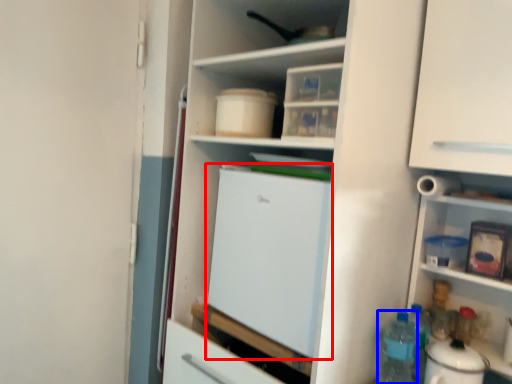
Question: Which point is closer to the camera, refrigerator (highlighted by a red box) or bottle (highlighted by a blue box)?

Choices:
 (A) refrigerator
 (B) bottle

Answer: (A)